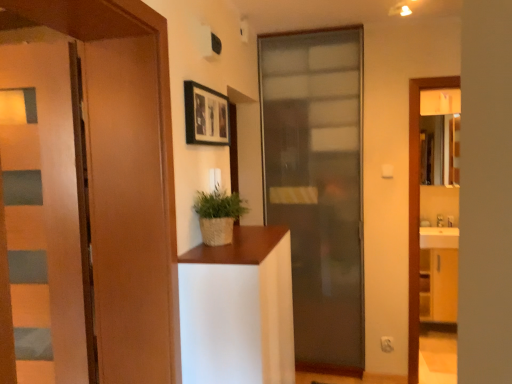
Identify the location of braided straw pot at center. (218, 215).

What is the approximate width of wooden door at left, which is the 2th door in front-to-back order?

0.97 inches.

This screenshot has height=384, width=512. What do you see at coordinates (127, 181) in the screenshot?
I see `matte brown door at left, the 2th door positioned from the left` at bounding box center [127, 181].

The image size is (512, 384). I want to click on braided straw pot at center, so click(x=218, y=215).

Is white matte cabinet at center bigger or smaller than matte brown door at left, arranged as the 1th door when viewed from the front?

In the image, white matte cabinet at center appears to be smaller than matte brown door at left, arranged as the 1th door when viewed from the front.

Considering the positions of objects white matte cabinet at center and matte brown door at left, acting as the 2th door starting from the right, in the image provided, who is more to the left, white matte cabinet at center or matte brown door at left, acting as the 2th door starting from the right,?

matte brown door at left, acting as the 2th door starting from the right.

Does white matte cabinet at center touch matte brown door at left, acting as the 2th door starting from the right?

white matte cabinet at center and matte brown door at left, acting as the 2th door starting from the right, are clearly separated.

From the image's perspective, relative to matte brown door at left, acting as the 2th door starting from the right, is white matte cabinet at center above or below?

From the image's perspective, white matte cabinet at center appears below matte brown door at left, acting as the 2th door starting from the right.

Measure the distance from braided straw pot at center to translucent glass door at center, the first door in the back-to-front sequence.

The distance of braided straw pot at center from translucent glass door at center, the first door in the back-to-front sequence, is 4.37 feet.

From the image's perspective, is braided straw pot at center located above or below translucent glass door at center, the third door viewed from the left?

braided straw pot at center is situated higher than translucent glass door at center, the third door viewed from the left, in the image.

Is point (219, 198) less distant than point (316, 302)?

Yes, it is.

Who is more distant, braided straw pot at center or translucent glass door at center, acting as the 1th door starting from the right?

translucent glass door at center, acting as the 1th door starting from the right, is further from the camera.

From the image's perspective, which object appears higher, black matte picture frame at upper center or translucent glass door at center, arranged as the 3th door when viewed from the front?

black matte picture frame at upper center appears higher in the image.

Does black matte picture frame at upper center have a smaller size compared to translucent glass door at center, the third door viewed from the left?

Yes.

Is black matte picture frame at upper center next to translucent glass door at center, arranged as the 3th door when viewed from the front?

No, black matte picture frame at upper center is not making contact with translucent glass door at center, arranged as the 3th door when viewed from the front.

Which is in front, point (240, 201) or point (61, 326)?

Point (61, 326)

From their relative heights in the image, would you say braided straw pot at center is taller or shorter than wooden door at left, arranged as the 1th door when viewed from the left?

A: braided straw pot at center is shorter than wooden door at left, arranged as the 1th door when viewed from the left.

From the image's perspective, is braided straw pot at center on wooden door at left, arranged as the 1th door when viewed from the left?

Yes.

What's the angular difference between braided straw pot at center and wooden door at left, arranged as the 1th door when viewed from the left,'s facing directions?

The angular difference between braided straw pot at center and wooden door at left, arranged as the 1th door when viewed from the left, is 0.716 degrees.

From the image's perspective, which is below, wooden door at left, the third door positioned from the right, or translucent glass door at center, the third door viewed from the left?

From the image's view, wooden door at left, the third door positioned from the right, is below.

Is the position of wooden door at left, placed as the 2th door when sorted from back to front, more distant than that of translucent glass door at center, acting as the 1th door starting from the right?

That is False.

Is the surface of wooden door at left, arranged as the 1th door when viewed from the left, in direct contact with translucent glass door at center, the third door viewed from the left?

No, wooden door at left, arranged as the 1th door when viewed from the left, is not making contact with translucent glass door at center, the third door viewed from the left.

From a real-world perspective, is wooden door at left, placed as the 2th door when sorted from back to front, on top of translucent glass door at center, acting as the 1th door starting from the right?

Yes, from a real-world perspective, wooden door at left, placed as the 2th door when sorted from back to front, is on top of translucent glass door at center, acting as the 1th door starting from the right.

How different are the orientations of wooden door at left, the third door positioned from the right, and matte brown door at left, marked as the third door in a back-to-front arrangement, in degrees?

They differ by 0.451 degrees in their facing directions.

Which of these two, wooden door at left, which is the 2th door in front-to-back order, or matte brown door at left, arranged as the 1th door when viewed from the front, is wider?

Wider between the two is matte brown door at left, arranged as the 1th door when viewed from the front.

From a real-world perspective, is wooden door at left, which is the 2th door in front-to-back order, above or below matte brown door at left, acting as the 2th door starting from the right?

wooden door at left, which is the 2th door in front-to-back order, is below matte brown door at left, acting as the 2th door starting from the right.

Could you measure the distance between wooden door at left, which is the 2th door in front-to-back order, and matte brown door at left, acting as the 2th door starting from the right?

wooden door at left, which is the 2th door in front-to-back order, and matte brown door at left, acting as the 2th door starting from the right, are 19.64 centimeters apart.

Is translucent glass door at center, the third door viewed from the left, looking in the opposite direction of braided straw pot at center?

No, translucent glass door at center, the third door viewed from the left, is not facing away from braided straw pot at center.

Which object is wider, translucent glass door at center, arranged as the 3th door when viewed from the front, or braided straw pot at center?

braided straw pot at center is wider.

How many degrees apart are the facing directions of translucent glass door at center, the first door in the back-to-front sequence, and braided straw pot at center?

90.8 degrees separate the facing orientations of translucent glass door at center, the first door in the back-to-front sequence, and braided straw pot at center.

From the image's perspective, is translucent glass door at center, arranged as the 3th door when viewed from the front, on braided straw pot at center?

No.

Locate an element on the screen. the 2nd door in front of the white matte cabinet at center is located at coordinates (127, 181).

This screenshot has height=384, width=512. What are the coordinates of `houseplant positioned vertically above the translucent glass door at center, the third door viewed from the left (from a real-world perspective)` in the screenshot? It's located at (218, 215).

When comparing their distances from wooden door at left, placed as the 2th door when sorted from back to front, does black matte picture frame at upper center or matte brown door at left, the 2th door positioned from the left, seem closer?

matte brown door at left, the 2th door positioned from the left, is closer to wooden door at left, placed as the 2th door when sorted from back to front.

Which object lies nearer to the anchor point translucent glass door at center, the third door viewed from the left, black matte picture frame at upper center or wooden door at left, the third door positioned from the right?

black matte picture frame at upper center.

Based on their spatial positions, is wooden door at left, the third door positioned from the right, or translucent glass door at center, arranged as the 3th door when viewed from the front, further from white matte cabinet at center?

translucent glass door at center, arranged as the 3th door when viewed from the front, is further to white matte cabinet at center.

From the image, which object appears to be nearer to matte brown door at left, arranged as the 1th door when viewed from the front, braided straw pot at center or black matte picture frame at upper center?

black matte picture frame at upper center is closer to matte brown door at left, arranged as the 1th door when viewed from the front.

From the image, which object appears to be farther from matte brown door at left, arranged as the 1th door when viewed from the front, black matte picture frame at upper center or white matte cabinet at center?

black matte picture frame at upper center is positioned further to the anchor matte brown door at left, arranged as the 1th door when viewed from the front.

Looking at the image, which one is located further to white matte cabinet at center, black matte picture frame at upper center or wooden door at left, placed as the 2th door when sorted from back to front?

Among the two, black matte picture frame at upper center is located further to white matte cabinet at center.

Which object lies further to the anchor point wooden door at left, the third door positioned from the right, braided straw pot at center or matte brown door at left, marked as the third door in a back-to-front arrangement?

The object further to wooden door at left, the third door positioned from the right, is braided straw pot at center.

Looking at the image, which one is located further to black matte picture frame at upper center, matte brown door at left, acting as the 2th door starting from the right, or braided straw pot at center?

The object further to black matte picture frame at upper center is matte brown door at left, acting as the 2th door starting from the right.

Identify the location of picture frame between braided straw pot at center and translucent glass door at center, arranged as the 3th door when viewed from the front, along the z-axis. (206, 115).

The image size is (512, 384). I want to click on door positioned between matte brown door at left, marked as the third door in a back-to-front arrangement, and white matte cabinet at center from near to far, so click(45, 212).

Where is `cabinetry between matte brown door at left, acting as the 2th door starting from the right, and translucent glass door at center, the first door in the back-to-front sequence, in the front-back direction`? The width and height of the screenshot is (512, 384). cabinetry between matte brown door at left, acting as the 2th door starting from the right, and translucent glass door at center, the first door in the back-to-front sequence, in the front-back direction is located at coordinates (238, 309).

This screenshot has height=384, width=512. I want to click on houseplant between wooden door at left, the third door positioned from the right, and translucent glass door at center, the first door in the back-to-front sequence, in the front-back direction, so click(x=218, y=215).